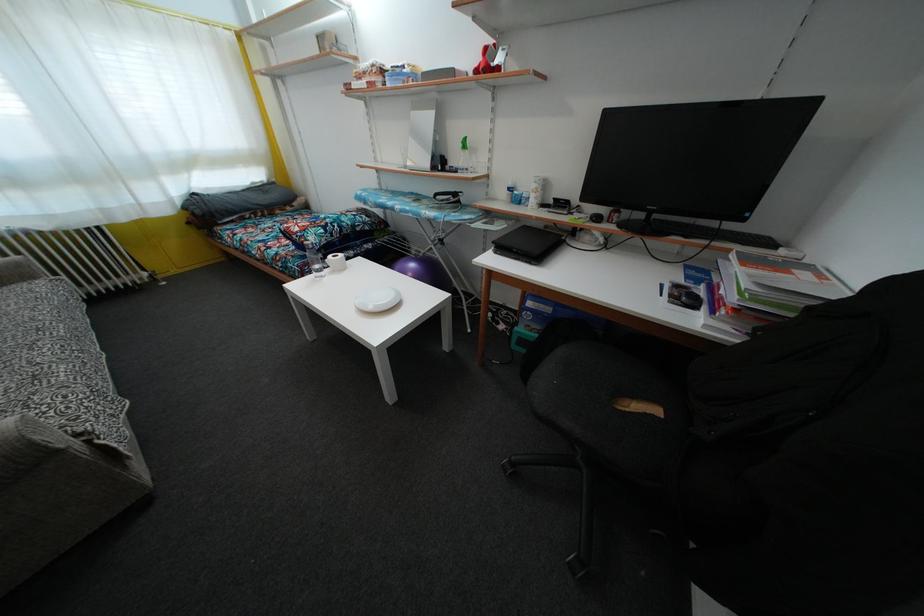
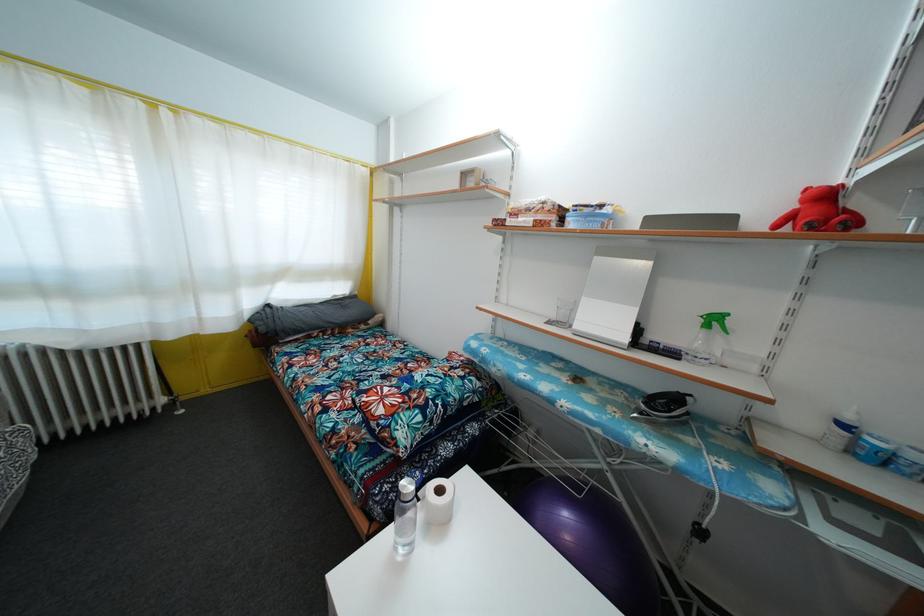
In a continuous first-person perspective shot, in which direction is the camera moving?

The cameraman moved toward left, forward.